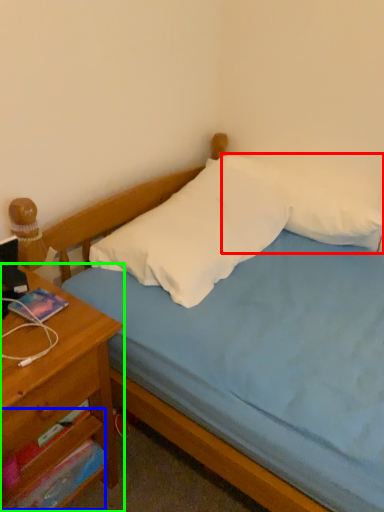
Question: Which is farther away from pillow (highlighted by a red box)? drawer (highlighted by a blue box) or nightstand (highlighted by a green box)?

Choices:
 (A) drawer
 (B) nightstand

Answer: (A)